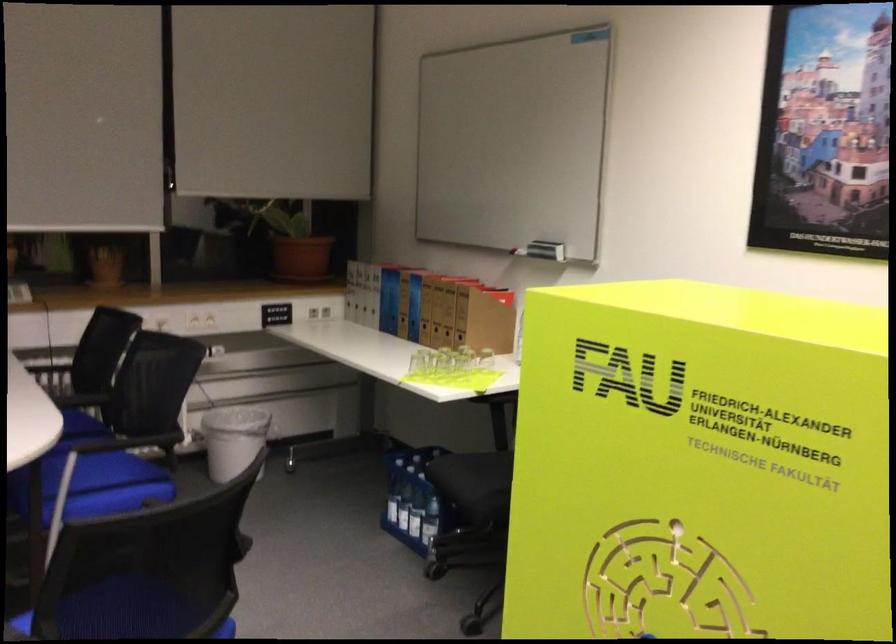
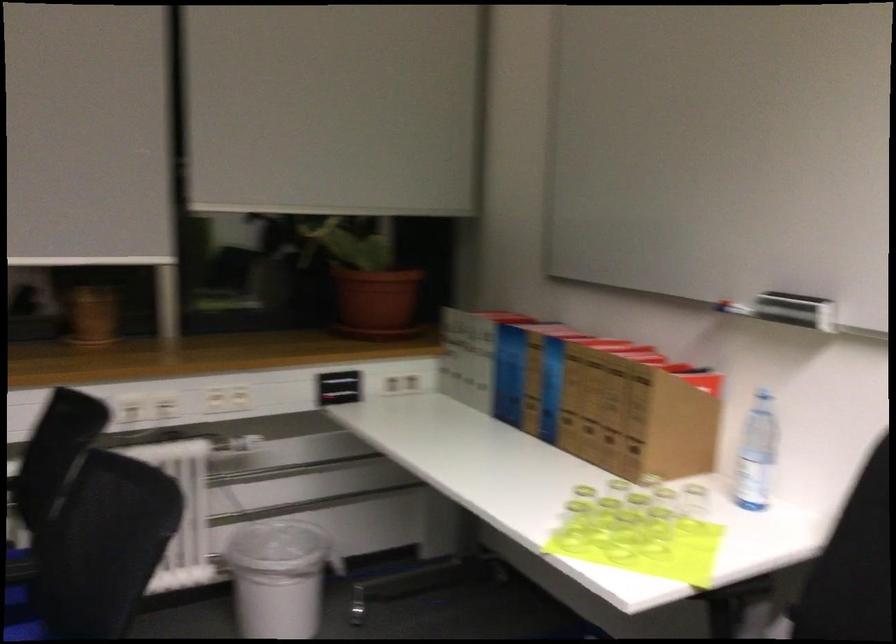
Question: I am providing you with two images of the same scene from different viewpoints. Which of the following objects are not visible in image2?

Choices:
 (A) black chair sitting surface
 (B) black rocker switch
 (C) plastic water bottle
 (D) none of these

Answer: (D)